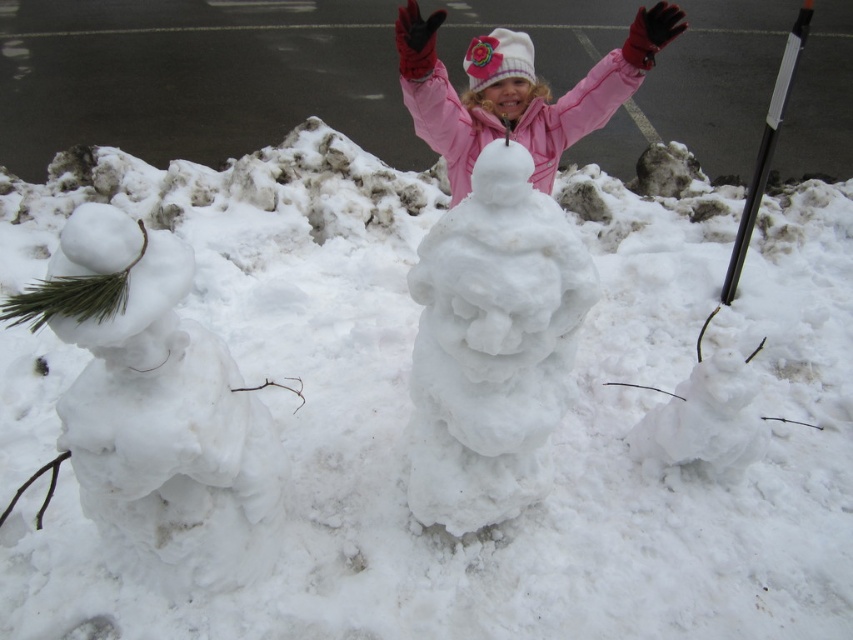
Is white fluffy snowman at center to the left of pink fleece jacket at center from the viewer's perspective?

Correct, you'll find white fluffy snowman at center to the left of pink fleece jacket at center.

From the picture: Is white fluffy snowman at center further to the viewer compared to pink fleece jacket at center?

No, white fluffy snowman at center is closer to the viewer.

Which is behind, point (485, 208) or point (618, 93)?

The point (618, 93) is more distant.

You are a GUI agent. You are given a task and a screenshot of the screen. Output one action in this format:
    pyautogui.click(x=<x>, y=<y>)
    Task: Click on the white fluffy snowman at center
    The height and width of the screenshot is (640, 853).
    Given the screenshot: What is the action you would take?
    pyautogui.click(x=492, y=346)

Can you confirm if white fluffy snowman at left is shorter than white fluffy snowman at center?

Indeed, white fluffy snowman at left has a lesser height compared to white fluffy snowman at center.

Does point (239, 403) lie behind point (467, 408)?

No, it is in front of (467, 408).

The height and width of the screenshot is (640, 853). What are the coordinates of `white fluffy snowman at left` in the screenshot? It's located at (154, 410).

Based on the photo, between white fluffy snowman at left and pink fleece jacket at center, which one appears on the right side from the viewer's perspective?

Positioned to the right is pink fleece jacket at center.

Locate an element on the screen. The width and height of the screenshot is (853, 640). white fluffy snowman at left is located at coordinates (154, 410).

The height and width of the screenshot is (640, 853). Describe the element at coordinates (154, 410) in the screenshot. I see `white fluffy snowman at left` at that location.

The height and width of the screenshot is (640, 853). Find the location of `white fluffy snowman at left`. white fluffy snowman at left is located at coordinates point(154,410).